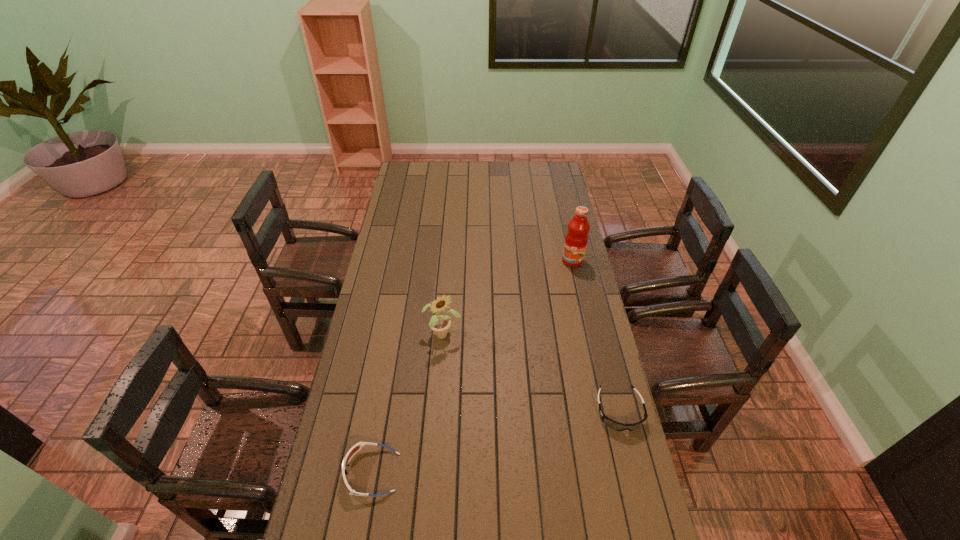
The image size is (960, 540). In order to click on free space on the desktop that is between the leftmost object and the right goggles and is positioned on the front label of the tallest object in this screenshot , I will do `click(490, 443)`.

You are a GUI agent. You are given a task and a screenshot of the screen. Output one action in this format:
    pyautogui.click(x=<x>, y=<y>)
    Task: Click on the vacant space on the desktop that is between the nearest object and the third farthest object and is positioned on the front-facing side of the third object from right to left
    Image resolution: width=960 pixels, height=540 pixels.
    Given the screenshot: What is the action you would take?
    pyautogui.click(x=508, y=438)